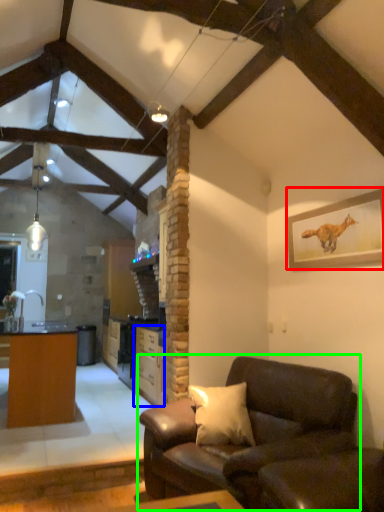
Question: Which object is positioned farthest from picture frame (highlighted by a red box)? Select from cabinetry (highlighted by a blue box) and studio couch (highlighted by a green box).

Choices:
 (A) cabinetry
 (B) studio couch

Answer: (A)